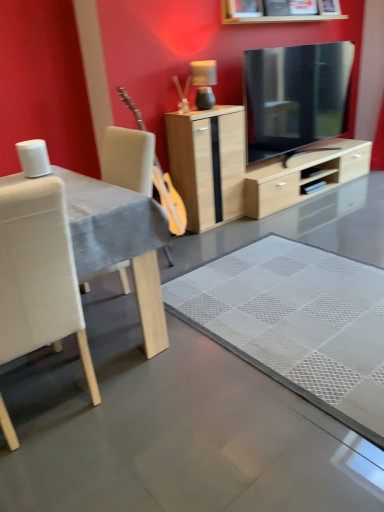
Question: Is the position of white fabric table at left more distant than that of white fabric chair at left?

Choices:
 (A) no
 (B) yes

Answer: (B)

Question: Is white fabric table at left to the left of white fabric chair at left from the viewer's perspective?

Choices:
 (A) no
 (B) yes

Answer: (A)

Question: Does white fabric table at left turn towards white fabric chair at left?

Choices:
 (A) no
 (B) yes

Answer: (A)

Question: Is white fabric table at left far away from white fabric chair at left?

Choices:
 (A) no
 (B) yes

Answer: (A)

Question: Is white fabric table at left smaller than white fabric chair at left?

Choices:
 (A) yes
 (B) no

Answer: (B)

Question: In terms of height, does white fabric chair at left look taller or shorter compared to white fabric table at left?

Choices:
 (A) short
 (B) tall

Answer: (B)

Question: From the image's perspective, is white fabric chair at left above or below white fabric table at left?

Choices:
 (A) above
 (B) below

Answer: (B)

Question: Looking at the image, does white fabric chair at left seem bigger or smaller compared to white fabric table at left?

Choices:
 (A) small
 (B) big

Answer: (A)

Question: In terms of width, does white fabric chair at left look wider or thinner when compared to white fabric table at left?

Choices:
 (A) thin
 (B) wide

Answer: (A)

Question: Looking at their shapes, would you say light wood/glossy cabinet at center is wider or thinner than white fabric table at left?

Choices:
 (A) wide
 (B) thin

Answer: (B)

Question: Choose the correct answer: Is light wood/glossy cabinet at center inside white fabric table at left or outside it?

Choices:
 (A) inside
 (B) outside

Answer: (B)

Question: From their relative heights in the image, would you say light wood/glossy cabinet at center is taller or shorter than white fabric table at left?

Choices:
 (A) tall
 (B) short

Answer: (B)

Question: Considering the relative positions of light wood/glossy cabinet at center and white fabric table at left in the image provided, is light wood/glossy cabinet at center to the left or to the right of white fabric table at left?

Choices:
 (A) right
 (B) left

Answer: (A)

Question: Considering the positions of point (36, 303) and point (173, 134), is point (36, 303) closer or farther from the camera than point (173, 134)?

Choices:
 (A) farther
 (B) closer

Answer: (B)

Question: From a real-world perspective, relative to light wood/glossy cabinet at center, is white fabric chair at left vertically above or below?

Choices:
 (A) above
 (B) below

Answer: (A)